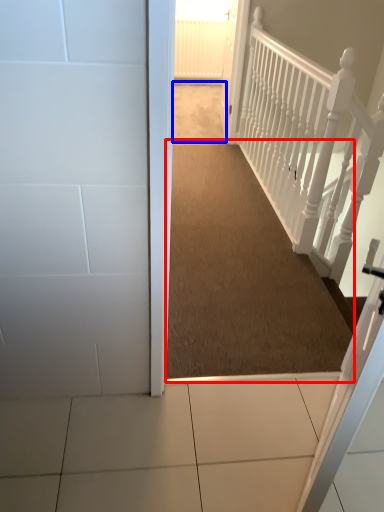
Question: Which point is closer to the camera, corridor (highlighted by a red box) or path (highlighted by a blue box)?

Choices:
 (A) corridor
 (B) path

Answer: (A)